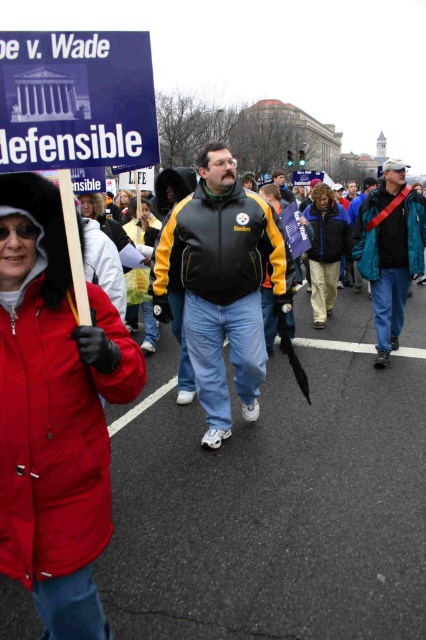
Question: Which of the following is the farthest from the observer?

Choices:
 (A) khaki pants at center
 (B) black leather jacket at center
 (C) yellow fabric jacket at center

Answer: (A)

Question: Does blue paper sign at upper left come behind teal fabric jacket at center?

Choices:
 (A) no
 (B) yes

Answer: (A)

Question: Estimate the real-world distances between objects in this image. Which object is closer to the black leather jacket at center?

Choices:
 (A) khaki pants at center
 (B) yellow fabric jacket at center
 (C) teal fabric jacket at center

Answer: (B)

Question: Considering the real-world distances, which object is farthest from the dark blue jacket at center?

Choices:
 (A) yellow fabric jacket at center
 (B) blue paper sign at upper left

Answer: (B)

Question: Can you confirm if teal matte jacket at center-right is bigger than yellow fabric jacket at center?

Choices:
 (A) yes
 (B) no

Answer: (B)

Question: Is black leather jacket at center further to the viewer compared to leather jacket at center?

Choices:
 (A) no
 (B) yes

Answer: (A)